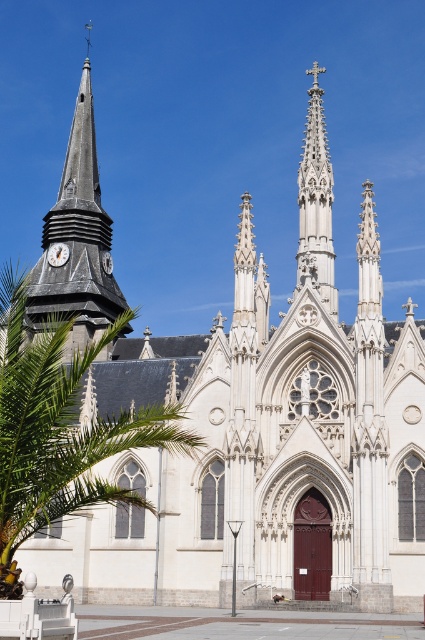
Question: Which point appears closest to the camera in this image?

Choices:
 (A) (308, 228)
 (B) (51, 227)
 (C) (11, 282)

Answer: (C)

Question: Can you confirm if dark gray stone steeple at left is positioned below white stone spire at center?

Choices:
 (A) yes
 (B) no

Answer: (B)

Question: Estimate the real-world distances between objects in this image. Which object is closer to the green leafy palm tree at left?

Choices:
 (A) white stone spire at center
 (B) matte black clock at upper left
 (C) dark gray stone steeple at left

Answer: (C)

Question: Does dark gray stone steeple at left appear under white stone spire at center?

Choices:
 (A) no
 (B) yes

Answer: (A)

Question: Can you confirm if green leafy palm tree at left is positioned to the right of dark gray stone steeple at left?

Choices:
 (A) no
 (B) yes

Answer: (B)

Question: Which of the following is the farthest from the observer?

Choices:
 (A) matte black clock at upper left
 (B) dark gray stone steeple at left

Answer: (A)